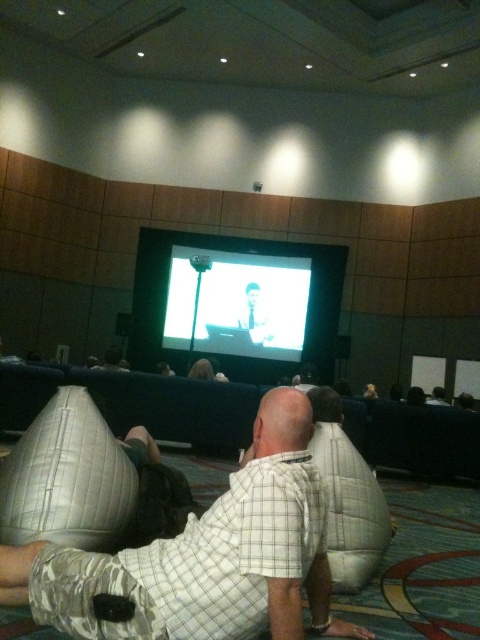
Question: Where is white checkered shirt at center located in relation to light brown suit at center in the image?

Choices:
 (A) above
 (B) below

Answer: (B)

Question: Considering the real-world distances, which object is closest to the matte white screen at center?

Choices:
 (A) light brown suit at center
 (B) white checkered shirt at center

Answer: (A)

Question: Which object is closer to the camera taking this photo?

Choices:
 (A) light brown suit at center
 (B) white checkered shirt at center

Answer: (B)

Question: Is white checkered shirt at center above matte white screen at center?

Choices:
 (A) yes
 (B) no

Answer: (B)

Question: Which point is farther to the camera?

Choices:
 (A) (264, 326)
 (B) (213, 291)

Answer: (B)

Question: Does matte white screen at center appear on the right side of light brown suit at center?

Choices:
 (A) no
 (B) yes

Answer: (A)